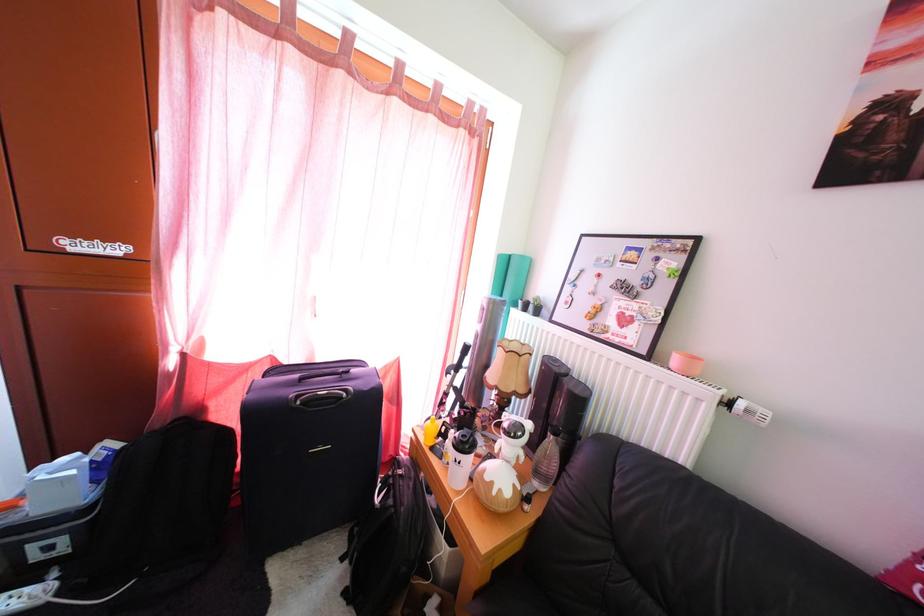
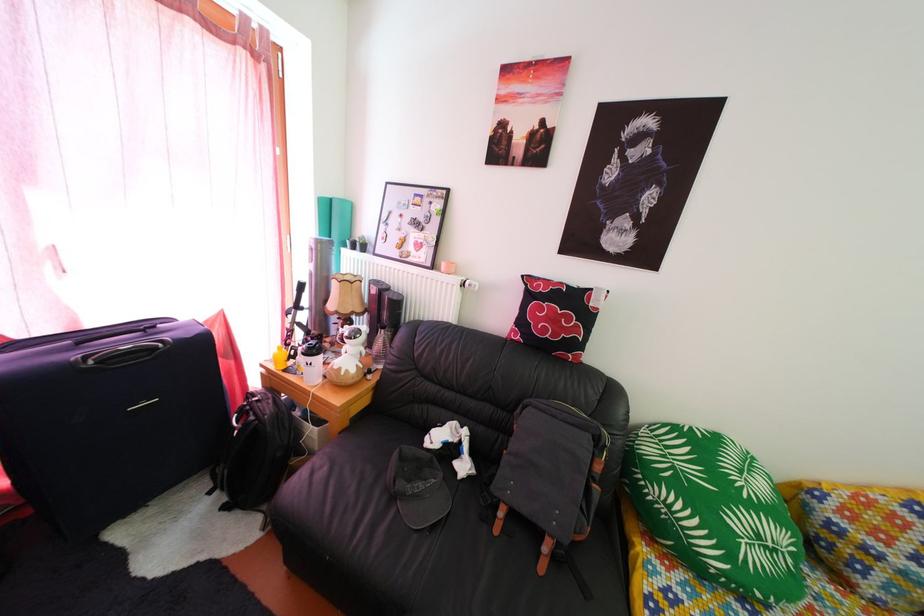
The point at (x=419, y=493) is marked in the first image. Where is the corresponding point in the second image?

(280, 410)